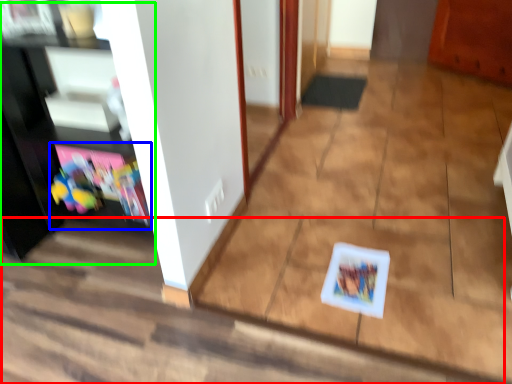
Question: Which object is positioned closest to stair (highlighted by a red box)? Select from shelf (highlighted by a blue box) and entertainment center (highlighted by a green box).

Choices:
 (A) shelf
 (B) entertainment center

Answer: (A)